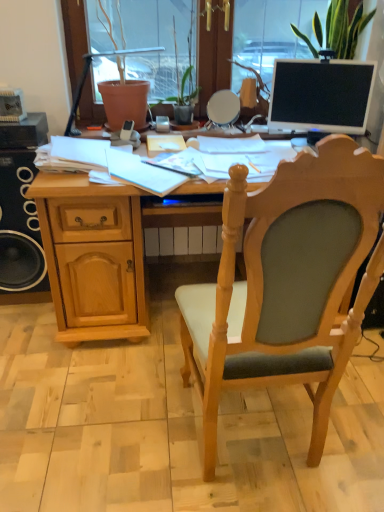
Question: Is black matte speaker at left positioned with its back to light wood desk at center?

Choices:
 (A) no
 (B) yes

Answer: (A)

Question: Does black matte speaker at left have a smaller size compared to light wood desk at center?

Choices:
 (A) yes
 (B) no

Answer: (A)

Question: From a real-world perspective, is black matte speaker at left located higher than light wood desk at center?

Choices:
 (A) no
 (B) yes

Answer: (B)

Question: Can light wood desk at center be found inside black matte speaker at left?

Choices:
 (A) yes
 (B) no

Answer: (B)

Question: Can you confirm if black matte speaker at left is wider than light wood desk at center?

Choices:
 (A) no
 (B) yes

Answer: (A)

Question: Is light wood/wooden chair at center to the left or to the right of light wood desk at center in the image?

Choices:
 (A) left
 (B) right

Answer: (B)

Question: From the image's perspective, relative to light wood desk at center, is light wood/wooden chair at center above or below?

Choices:
 (A) above
 (B) below

Answer: (B)

Question: From their relative heights in the image, would you say light wood/wooden chair at center is taller or shorter than light wood desk at center?

Choices:
 (A) tall
 (B) short

Answer: (A)

Question: Relative to light wood desk at center, is light wood/wooden chair at center in front or behind?

Choices:
 (A) behind
 (B) front

Answer: (B)

Question: Does point (324, 31) appear closer or farther from the camera than point (89, 294)?

Choices:
 (A) closer
 (B) farther

Answer: (B)

Question: Relative to light wood desk at center, is green textured plant at upper right in front or behind?

Choices:
 (A) behind
 (B) front

Answer: (A)

Question: In the image, is green textured plant at upper right on the left side or the right side of light wood desk at center?

Choices:
 (A) left
 (B) right

Answer: (B)

Question: Is green textured plant at upper right inside the boundaries of light wood desk at center, or outside?

Choices:
 (A) inside
 (B) outside

Answer: (B)

Question: Is light wood/wooden chair at center to the left or to the right of black matte speaker at left in the image?

Choices:
 (A) left
 (B) right

Answer: (B)

Question: In the image, is light wood/wooden chair at center positioned in front of or behind black matte speaker at left?

Choices:
 (A) front
 (B) behind

Answer: (A)